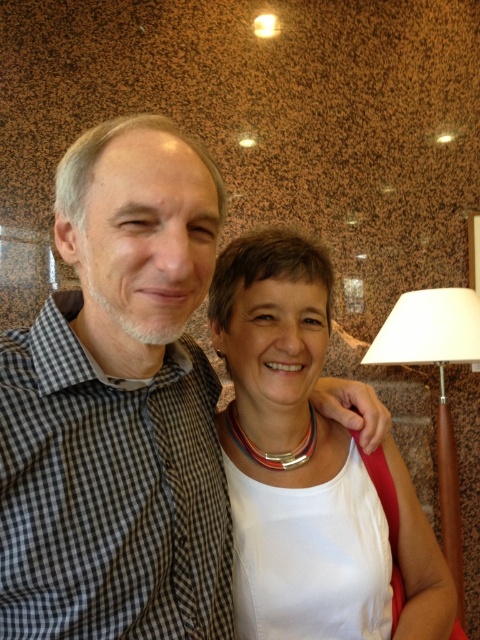
Based on the scene description, can you identify what object is located at the coordinates point (292,452)?

The white matte necklace at center is located at point (292,452).

You are a photographer who needs to ensure that the checkered fabric shirt at center and the wooden base lampshade at right are both visible in the photo. Given their sizes, which object will require more space in the frame to capture its details?

The checkered fabric shirt at center is larger in size than the wooden base lampshade at right, so it will require more space in the frame to capture its details.

You are taking a photo of two people standing in front of you. You notice two points marked on the image at coordinates point (52, 534) and point (312, 508). Which point is closer to your camera?

Point (52, 534) is closer to the camera than point (312, 508).